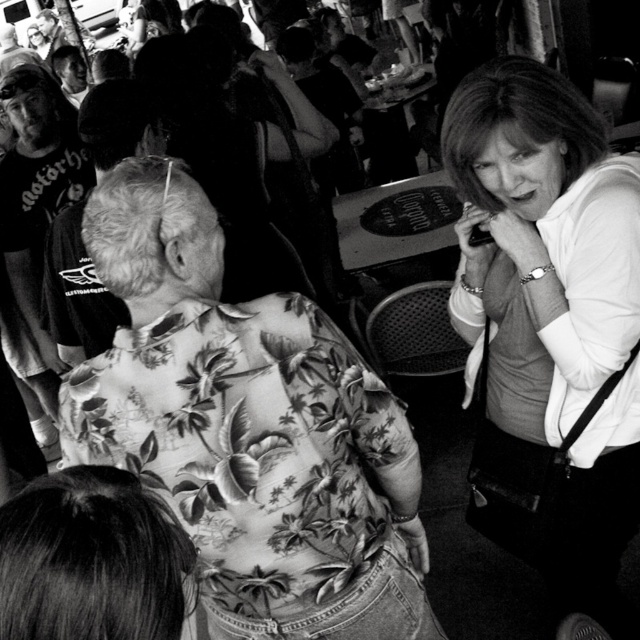
Does floral print shirt at center have a greater height compared to matte black t-shirt at left?

No, floral print shirt at center is not taller than matte black t-shirt at left.

Between floral print shirt at center and matte black t-shirt at left, which one appears on the right side from the viewer's perspective?

floral print shirt at center

The image size is (640, 640). I want to click on floral print shirt at center, so click(248, 428).

Who is more forward, [276,472] or [573,97]?

Point [276,472]

Who is positioned more to the right, floral print shirt at center or matte white shirt at right?

matte white shirt at right

Identify the location of floral print shirt at center. (248, 428).

How distant is matte white shirt at right from matte black t-shirt at left?

matte white shirt at right is 2.03 meters from matte black t-shirt at left.

Is point (500, 340) positioned after point (19, 134)?

No, (500, 340) is closer to viewer.

Does point (481, 93) lie in front of point (20, 282)?

Yes, it is.

This screenshot has height=640, width=640. I want to click on matte white shirt at right, so click(548, 324).